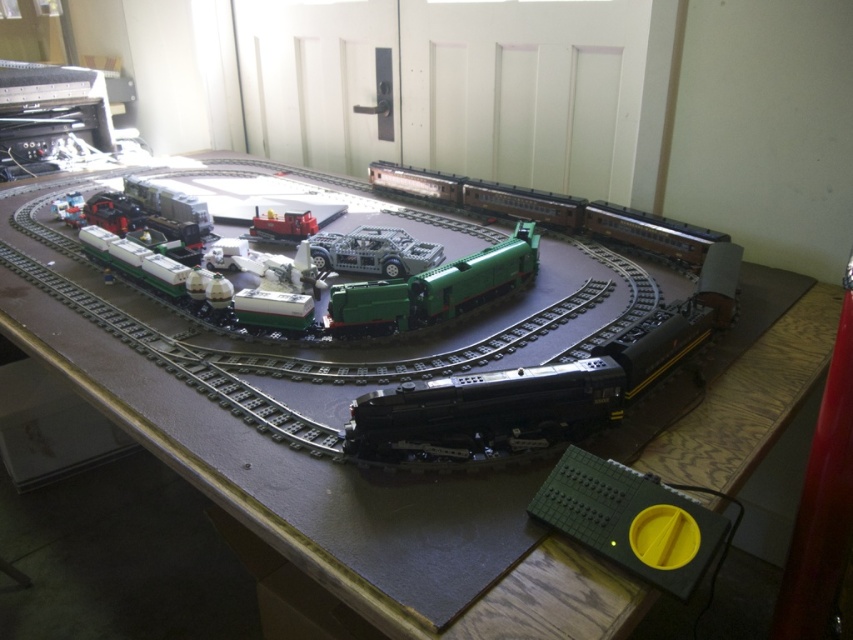
Question: Which point is closer to the camera taking this photo?

Choices:
 (A) (461, 278)
 (B) (543, 380)
 (C) (660, 224)

Answer: (B)

Question: Among these points, which one is nearest to the camera?

Choices:
 (A) (457, 304)
 (B) (485, 198)
 (C) (624, 358)

Answer: (C)

Question: Considering the relative positions of green plastic train at center and translucent gray plastic car at center in the image provided, where is green plastic train at center located with respect to translucent gray plastic car at center?

Choices:
 (A) left
 (B) right

Answer: (B)

Question: Among these objects, which one is farthest from the camera?

Choices:
 (A) shiny black train at center
 (B) brown matte train car at center

Answer: (B)

Question: Is green plastic train at center bigger than translucent gray plastic car at center?

Choices:
 (A) yes
 (B) no

Answer: (A)

Question: Does shiny black train at center have a lesser width compared to translucent gray plastic car at center?

Choices:
 (A) yes
 (B) no

Answer: (B)